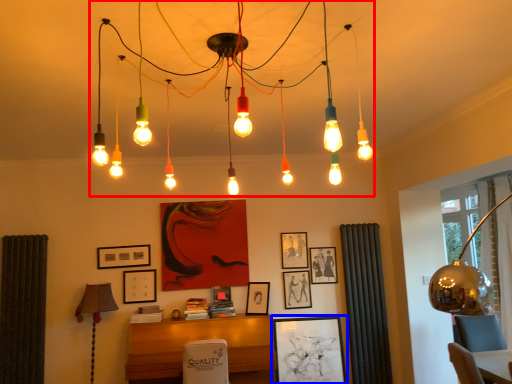
Question: Which point is further to the camera, chandelier (highlighted by a red box) or picture frame (highlighted by a blue box)?

Choices:
 (A) chandelier
 (B) picture frame

Answer: (B)